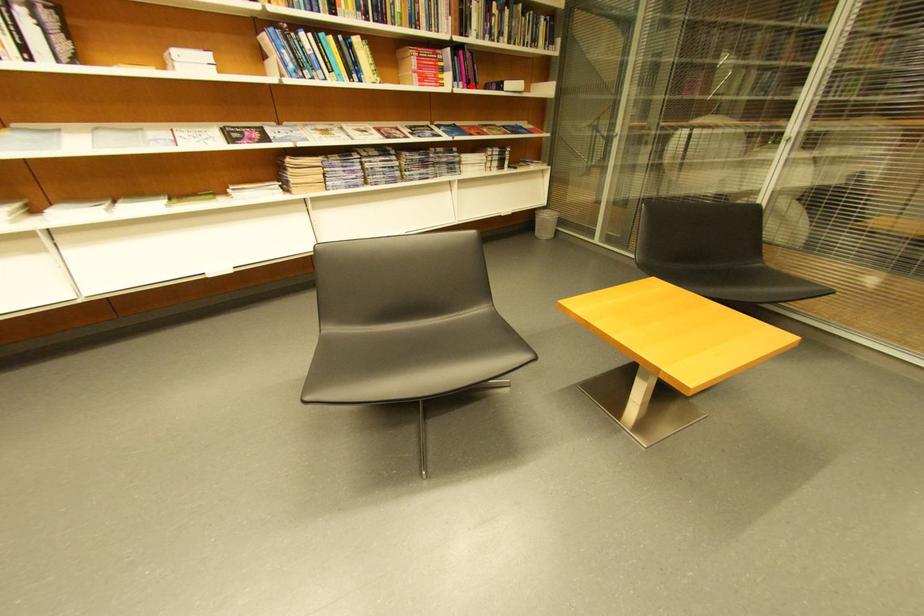
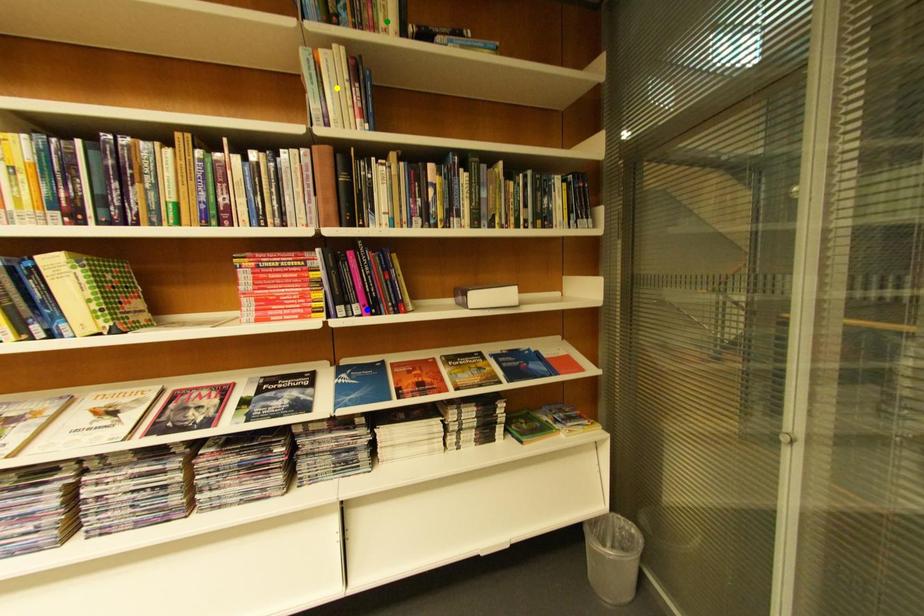
Question: I am providing you with two images of the same scene from different viewpoints. A red point is marked on the first image. You are given multiple points on the second image. Can you choose the point in image 2 that corresponds to the point in image 1?

Choices:
 (A) yellow point
 (B) green point
 (C) blue point

Answer: (C)